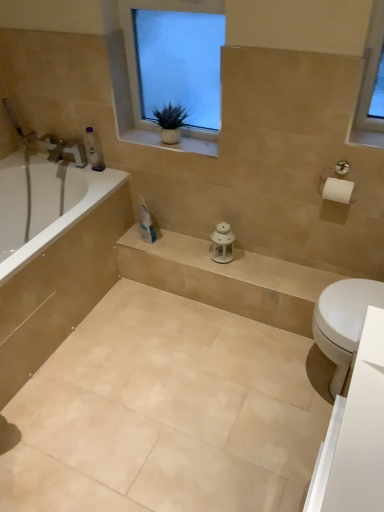
From the picture: What is the approximate width of beige ceramic tile at lower center?

4.15 feet.

Describe the element at coordinates (93, 149) in the screenshot. The height and width of the screenshot is (512, 384). I see `translucent plastic bottle at upper left` at that location.

The image size is (384, 512). What do you see at coordinates (45, 205) in the screenshot?
I see `white glossy bathtub at left` at bounding box center [45, 205].

Image resolution: width=384 pixels, height=512 pixels. I want to click on white textured window at upper center, so click(x=174, y=67).

Does white textured window at upper center have a greater width compared to white glossy bathtub at left?

No.

From the image's perspective, is white textured window at upper center positioned above or below white glossy bathtub at left?

white textured window at upper center is situated higher than white glossy bathtub at left in the image.

Which is closer, (141, 133) or (37, 175)?

Clearly, point (141, 133) is closer to the camera than point (37, 175).

Is white textured window at upper center completely or partially outside of translucent plastic bottle at upper left?

Absolutely, white textured window at upper center is external to translucent plastic bottle at upper left.

Which is nearer, (153, 104) or (98, 168)?

The point (153, 104) is closer.

Can you confirm if white textured window at upper center is positioned to the left of translucent plastic bottle at upper left?

No.

Is white textured window at upper center thinner than translucent plastic bottle at upper left?

In fact, white textured window at upper center might be wider than translucent plastic bottle at upper left.

From a real-world perspective, which object stands above the other?

In real-world perspective, green matte plant at upper center is above.

Is beige ceramic tile at lower center positioned behind green matte plant at upper center?

No, beige ceramic tile at lower center is in front of green matte plant at upper center.

Consider the image. Are translucent plastic bottle at upper left and green matte plant at upper center beside each other?

No, translucent plastic bottle at upper left is not making contact with green matte plant at upper center.

Is translucent plastic bottle at upper left spatially inside green matte plant at upper center, or outside of it?

The correct answer is: outside.

Does point (92, 140) appear closer or farther from the camera than point (157, 114)?

Point (92, 140) is farther from the camera than point (157, 114).

Is white glossy bathtub at left in front of or behind green matte plant at upper center in the image?

white glossy bathtub at left is behind green matte plant at upper center.

From a real-world perspective, who is located lower, white glossy bathtub at left or green matte plant at upper center?

white glossy bathtub at left.

Based on their positions, is white glossy bathtub at left located to the left or right of green matte plant at upper center?

In the image, white glossy bathtub at left appears on the left side of green matte plant at upper center.

Can you confirm if white glossy bathtub at left is taller than green matte plant at upper center?

Yes, white glossy bathtub at left is taller than green matte plant at upper center.

Is green matte plant at upper center to the left or to the right of beige stone balustrade at center in the image?

In the image, green matte plant at upper center appears on the left side of beige stone balustrade at center.

Are green matte plant at upper center and beige stone balustrade at center beside each other?

No, green matte plant at upper center is not touching beige stone balustrade at center.

Does point (168, 143) lie behind point (227, 275)?

No, it is in front of (227, 275).

Between green matte plant at upper center and beige stone balustrade at center, which one has less height?

With less height is beige stone balustrade at center.

Which object is further away from the camera, translucent plastic bottle at upper left or white textured window at upper center?

Positioned behind is translucent plastic bottle at upper left.

Considering the relative positions of translucent plastic bottle at upper left and white textured window at upper center in the image provided, is translucent plastic bottle at upper left to the right of white textured window at upper center from the viewer's perspective?

No, translucent plastic bottle at upper left is not to the right of white textured window at upper center.

Considering the sizes of translucent plastic bottle at upper left and white textured window at upper center in the image, is translucent plastic bottle at upper left bigger or smaller than white textured window at upper center?

translucent plastic bottle at upper left is smaller than white textured window at upper center.

Find the location of a particular element. The image size is (384, 512). window above the white glossy bathtub at left (from a real-world perspective) is located at coordinates (174, 67).

Identify the location of window on the right of translucent plastic bottle at upper left. The width and height of the screenshot is (384, 512). (174, 67).

Estimate the real-world distances between objects in this image. Which object is closer to beige stone balustrade at center, white textured window at upper center or beige ceramic tile at lower center?

beige ceramic tile at lower center is positioned closer to the anchor beige stone balustrade at center.

Based on their spatial positions, is beige stone balustrade at center or white textured window at upper center further from white glossy bathtub at left?

Among the two, white textured window at upper center is located further to white glossy bathtub at left.

Looking at the image, which one is located further to white textured window at upper center, translucent plastic bottle at upper left or white glossy bathtub at left?

The object further to white textured window at upper center is white glossy bathtub at left.

Based on their spatial positions, is green matte plant at upper center or translucent plastic bottle at upper left further from beige stone balustrade at center?

Among the two, translucent plastic bottle at upper left is located further to beige stone balustrade at center.

When comparing their distances from beige stone balustrade at center, does translucent plastic bottle at upper left or beige ceramic tile at lower center seem further?

The object further to beige stone balustrade at center is translucent plastic bottle at upper left.

Looking at the image, which one is located closer to translucent plastic bottle at upper left, beige stone balustrade at center or white glossy bathtub at left?

Among the two, white glossy bathtub at left is located nearer to translucent plastic bottle at upper left.

When comparing their distances from white glossy bathtub at left, does beige ceramic tile at lower center or translucent plastic bottle at upper left seem further?

Among the two, beige ceramic tile at lower center is located further to white glossy bathtub at left.

Considering their positions, is white textured window at upper center positioned further to beige stone balustrade at center than translucent plastic bottle at upper left?

translucent plastic bottle at upper left.

You are a GUI agent. You are given a task and a screenshot of the screen. Output one action in this format:
    pyautogui.click(x=<x>, y=<y>)
    Task: Click on the toiletry between white textured window at upper center and beige stone balustrade at center in the up-down direction
    
    Given the screenshot: What is the action you would take?
    pyautogui.click(x=93, y=149)

The image size is (384, 512). Find the location of `toiletry between white glossy bathtub at left and green matte plant at upper center in the horizontal direction`. toiletry between white glossy bathtub at left and green matte plant at upper center in the horizontal direction is located at coordinates (93, 149).

The image size is (384, 512). I want to click on houseplant between white textured window at upper center and beige stone balustrade at center from top to bottom, so click(x=170, y=122).

Identify the location of toiletry between green matte plant at upper center and beige ceramic tile at lower center vertically. (93, 149).